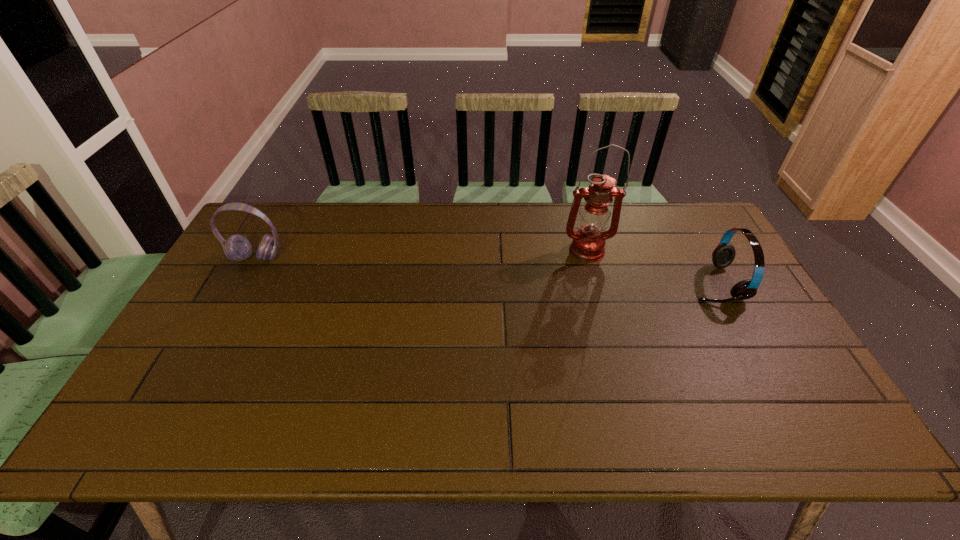
The image size is (960, 540). I want to click on empty location between the left headset and the shortest object, so click(x=486, y=271).

Identify the location of vacant area between the tallest object and the shortest object. The width and height of the screenshot is (960, 540). click(650, 267).

The width and height of the screenshot is (960, 540). What are the coordinates of `free space between the oil lamp and the rightmost object` in the screenshot? It's located at (650, 267).

At what (x,y) coordinates should I click in order to perform the action: click on free space between the oil lamp and the right headset. Please return your answer as a coordinate pair (x, y). This screenshot has width=960, height=540. Looking at the image, I should click on (650, 267).

Where is `vacant area between the leftmost object and the second object from right to left`? The width and height of the screenshot is (960, 540). vacant area between the leftmost object and the second object from right to left is located at coordinates (421, 254).

The height and width of the screenshot is (540, 960). I want to click on free space between the leftmost object and the right headset, so click(486, 271).

This screenshot has height=540, width=960. Identify the location of free space between the right headset and the tallest object. (650, 267).

Where is `vacant area that lies between the leftmost object and the oil lamp`? vacant area that lies between the leftmost object and the oil lamp is located at coordinates (421, 254).

Locate an element on the screen. This screenshot has height=540, width=960. free space between the rightmost object and the left headset is located at coordinates (486, 271).

Select which object appears as the second closest to the tallest object. Please provide its 2D coordinates. Your answer should be formatted as a tuple, i.e. [(x, y)], where the tuple contains the x and y coordinates of a point satisfying the conditions above.

[(237, 248)]